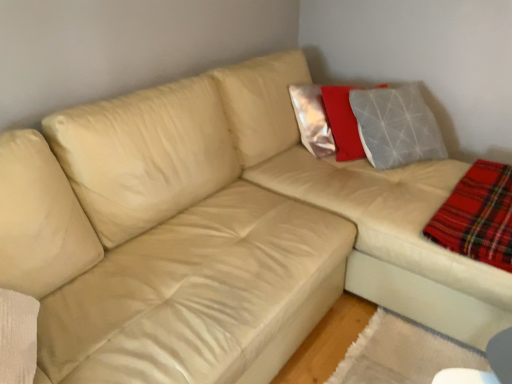
Where is `red plaid flannel at lower right`? The height and width of the screenshot is (384, 512). red plaid flannel at lower right is located at coordinates (478, 216).

Image resolution: width=512 pixels, height=384 pixels. What do you see at coordinates (478, 216) in the screenshot?
I see `red plaid flannel at lower right` at bounding box center [478, 216].

Image resolution: width=512 pixels, height=384 pixels. What are the coordinates of `red plaid flannel at lower right` in the screenshot? It's located at (478, 216).